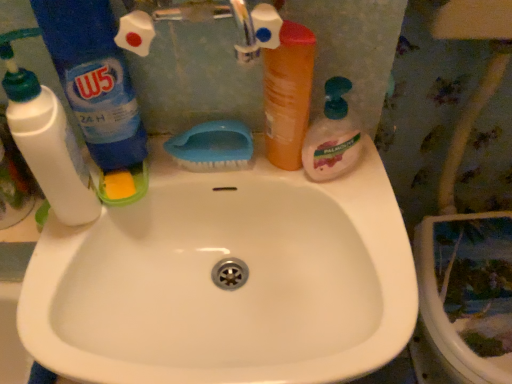
I want to click on blue plastic brush at upper center, so [212, 147].

Image resolution: width=512 pixels, height=384 pixels. What do you see at coordinates (288, 94) in the screenshot?
I see `orange matte bottle at upper center` at bounding box center [288, 94].

Find the location of a particular element. Image resolution: width=512 pixels, height=384 pixels. blue plastic bottle at left, which is counted as the second cleaning product, starting from the right is located at coordinates (98, 91).

Between blue plastic bottle at left, the second cleaning product positioned from the left, and orange matte bottle at upper center, which one has larger size?

Bigger between the two is blue plastic bottle at left, the second cleaning product positioned from the left.

Who is shorter, blue plastic bottle at left, the second cleaning product positioned from the left, or orange matte bottle at upper center?

orange matte bottle at upper center is shorter.

Considering the relative positions of blue plastic bottle at left, the second cleaning product positioned from the left, and orange matte bottle at upper center in the image provided, is blue plastic bottle at left, the second cleaning product positioned from the left, to the right of orange matte bottle at upper center from the viewer's perspective?

Incorrect, blue plastic bottle at left, the second cleaning product positioned from the left, is not on the right side of orange matte bottle at upper center.

Looking at this image, could you tell me if blue plastic bottle at left, the second cleaning product positioned from the left, is facing orange matte bottle at upper center?

No, blue plastic bottle at left, the second cleaning product positioned from the left, is not aimed at orange matte bottle at upper center.

Between blue plastic brush at upper center and blue plastic bottle at left, which is counted as the second cleaning product, starting from the right, which one has smaller width?

Thinner between the two is blue plastic brush at upper center.

How many degrees apart are the facing directions of blue plastic brush at upper center and blue plastic bottle at left, the second cleaning product positioned from the left?

There is a 13.7-degree angle between the facing directions of blue plastic brush at upper center and blue plastic bottle at left, the second cleaning product positioned from the left.

Based on their sizes in the image, would you say blue plastic brush at upper center is bigger or smaller than blue plastic bottle at left, which is counted as the second cleaning product, starting from the right?

Considering their sizes, blue plastic brush at upper center takes up less space than blue plastic bottle at left, which is counted as the second cleaning product, starting from the right.

Which is in front, blue plastic bottle at left, the second cleaning product positioned from the left, or white plastic bottle at left, which is the first cleaning product from left to right?

white plastic bottle at left, which is the first cleaning product from left to right, is in front.

From the picture: Is blue plastic bottle at left, the second cleaning product positioned from the left, aimed at white plastic bottle at left, placed as the 3th cleaning product when sorted from right to left?

No, blue plastic bottle at left, the second cleaning product positioned from the left, is not aimed at white plastic bottle at left, placed as the 3th cleaning product when sorted from right to left.

From the image's perspective, count 2nd cleaning products downward from the blue plastic bottle at left, the second cleaning product positioned from the left, and point to it. Please provide its 2D coordinates.

[(47, 139)]

Between point (109, 20) and point (48, 121), which one is positioned in front?

The point (48, 121) is in front.

Does translucent plastic soap dispenser at right, acting as the first cleaning product starting from the right, lie in front of orange matte bottle at upper center?

No, translucent plastic soap dispenser at right, acting as the first cleaning product starting from the right, is further to the viewer.

Are translucent plastic soap dispenser at right, acting as the first cleaning product starting from the right, and orange matte bottle at upper center located far from each other?

Actually, translucent plastic soap dispenser at right, acting as the first cleaning product starting from the right, and orange matte bottle at upper center are a little close together.

Which is more to the right, translucent plastic soap dispenser at right, which ranks as the third cleaning product in left-to-right order, or orange matte bottle at upper center?

translucent plastic soap dispenser at right, which ranks as the third cleaning product in left-to-right order, is more to the right.

How many degrees apart are the facing directions of translucent plastic soap dispenser at right, acting as the first cleaning product starting from the right, and orange matte bottle at upper center?

The facing directions of translucent plastic soap dispenser at right, acting as the first cleaning product starting from the right, and orange matte bottle at upper center are 59.7 degrees apart.

Considering the sizes of objects blue plastic bottle at left, which is counted as the second cleaning product, starting from the right, and translucent plastic soap dispenser at right, acting as the first cleaning product starting from the right, in the image provided, who is thinner, blue plastic bottle at left, which is counted as the second cleaning product, starting from the right, or translucent plastic soap dispenser at right, acting as the first cleaning product starting from the right,?

Thinner between the two is translucent plastic soap dispenser at right, acting as the first cleaning product starting from the right.

Is blue plastic bottle at left, the second cleaning product positioned from the left, with translucent plastic soap dispenser at right, acting as the first cleaning product starting from the right?

blue plastic bottle at left, the second cleaning product positioned from the left, is not next to translucent plastic soap dispenser at right, acting as the first cleaning product starting from the right, and they're not touching.

In the scene shown: From a real-world perspective, which object stands above the other?

blue plastic bottle at left, which is counted as the second cleaning product, starting from the right.

Which of these two, blue plastic bottle at left, which is counted as the second cleaning product, starting from the right, or translucent plastic soap dispenser at right, acting as the first cleaning product starting from the right, is bigger?

With larger size is blue plastic bottle at left, which is counted as the second cleaning product, starting from the right.

Is blue plastic brush at upper center wider or thinner than orange matte bottle at upper center?

blue plastic brush at upper center is wider than orange matte bottle at upper center.

Is blue plastic brush at upper center positioned with its back to orange matte bottle at upper center?

No, blue plastic brush at upper center is not facing the opposite direction of orange matte bottle at upper center.

Can you tell me how much blue plastic brush at upper center and orange matte bottle at upper center differ in facing direction?

The facing directions of blue plastic brush at upper center and orange matte bottle at upper center are 36.9 degrees apart.

Considering the positions of points (325, 91) and (92, 41), is point (325, 91) closer to camera compared to point (92, 41)?

No, (325, 91) is further to viewer.

How far apart are translucent plastic soap dispenser at right, acting as the first cleaning product starting from the right, and blue plastic bottle at left, which is counted as the second cleaning product, starting from the right?

A distance of 11.47 inches exists between translucent plastic soap dispenser at right, acting as the first cleaning product starting from the right, and blue plastic bottle at left, which is counted as the second cleaning product, starting from the right.

From a real-world perspective, is translucent plastic soap dispenser at right, which ranks as the third cleaning product in left-to-right order, positioned under blue plastic bottle at left, the second cleaning product positioned from the left, based on gravity?

Yes, from a real-world perspective, translucent plastic soap dispenser at right, which ranks as the third cleaning product in left-to-right order, is beneath blue plastic bottle at left, the second cleaning product positioned from the left.

Considering the sizes of objects translucent plastic soap dispenser at right, which ranks as the third cleaning product in left-to-right order, and blue plastic bottle at left, which is counted as the second cleaning product, starting from the right, in the image provided, who is shorter, translucent plastic soap dispenser at right, which ranks as the third cleaning product in left-to-right order, or blue plastic bottle at left, which is counted as the second cleaning product, starting from the right,?

Standing shorter between the two is translucent plastic soap dispenser at right, which ranks as the third cleaning product in left-to-right order.

This screenshot has width=512, height=384. In order to click on mouthwash behind the blue plastic bottle at left, which is counted as the second cleaning product, starting from the right in this screenshot , I will do `click(288, 94)`.

The width and height of the screenshot is (512, 384). Identify the location of the 1st cleaning product counting from the left side of the blue plastic brush at upper center. (98, 91).

Which object lies further to the anchor point translucent plastic soap dispenser at right, acting as the first cleaning product starting from the right, orange matte bottle at upper center or blue plastic brush at upper center?

Based on the image, blue plastic brush at upper center appears to be further to translucent plastic soap dispenser at right, acting as the first cleaning product starting from the right.

Which object lies nearer to the anchor point white plastic bottle at left, placed as the 3th cleaning product when sorted from right to left, blue plastic brush at upper center or orange matte bottle at upper center?

blue plastic brush at upper center is closer to white plastic bottle at left, placed as the 3th cleaning product when sorted from right to left.

Estimate the real-world distances between objects in this image. Which object is closer to white plastic bottle at left, which is the first cleaning product from left to right, translucent plastic soap dispenser at right, acting as the first cleaning product starting from the right, or orange matte bottle at upper center?

orange matte bottle at upper center is closer to white plastic bottle at left, which is the first cleaning product from left to right.

When comparing their distances from translucent plastic soap dispenser at right, acting as the first cleaning product starting from the right, does blue plastic bottle at left, which is counted as the second cleaning product, starting from the right, or orange matte bottle at upper center seem closer?

The object closer to translucent plastic soap dispenser at right, acting as the first cleaning product starting from the right, is orange matte bottle at upper center.

Which object lies further to the anchor point blue plastic brush at upper center, white plastic bottle at left, which is the first cleaning product from left to right, or blue plastic bottle at left, the second cleaning product positioned from the left?

The object further to blue plastic brush at upper center is white plastic bottle at left, which is the first cleaning product from left to right.

Which object lies nearer to the anchor point blue plastic brush at upper center, orange matte bottle at upper center or blue plastic bottle at left, the second cleaning product positioned from the left?

orange matte bottle at upper center.

Which object lies nearer to the anchor point translucent plastic soap dispenser at right, acting as the first cleaning product starting from the right, blue plastic bottle at left, which is counted as the second cleaning product, starting from the right, or white plastic bottle at left, placed as the 3th cleaning product when sorted from right to left?

Based on the image, blue plastic bottle at left, which is counted as the second cleaning product, starting from the right, appears to be nearer to translucent plastic soap dispenser at right, acting as the first cleaning product starting from the right.

Which object lies nearer to the anchor point blue plastic bottle at left, which is counted as the second cleaning product, starting from the right, orange matte bottle at upper center or blue plastic brush at upper center?

blue plastic brush at upper center is positioned closer to the anchor blue plastic bottle at left, which is counted as the second cleaning product, starting from the right.

Find the location of a particular element. The height and width of the screenshot is (384, 512). mouthwash situated between blue plastic brush at upper center and translucent plastic soap dispenser at right, which ranks as the third cleaning product in left-to-right order, from left to right is located at coordinates (288, 94).

Identify the location of mouthwash between blue plastic bottle at left, the second cleaning product positioned from the left, and translucent plastic soap dispenser at right, acting as the first cleaning product starting from the right, in the horizontal direction. (288, 94).

The width and height of the screenshot is (512, 384). I want to click on brush located between white plastic bottle at left, which is the first cleaning product from left to right, and orange matte bottle at upper center in the left-right direction, so [x=212, y=147].

You are a GUI agent. You are given a task and a screenshot of the screen. Output one action in this format:
    pyautogui.click(x=<x>, y=<y>)
    Task: Click on the mouthwash located between white plastic bottle at left, placed as the 3th cleaning product when sorted from right to left, and translucent plastic soap dispenser at right, acting as the first cleaning product starting from the right, in the left-right direction
    
    Given the screenshot: What is the action you would take?
    pyautogui.click(x=288, y=94)